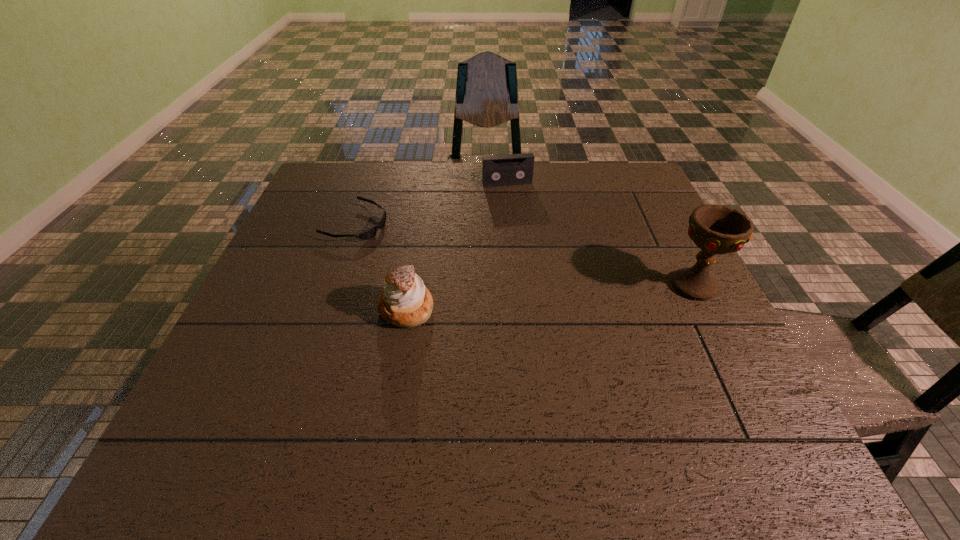
The image size is (960, 540). Identify the location of the second tallest object. (405, 302).

Identify the location of the second object from left to right. The height and width of the screenshot is (540, 960). (405, 302).

Identify the location of the rightmost object. Image resolution: width=960 pixels, height=540 pixels. (716, 229).

Where is `the tallest object`? Image resolution: width=960 pixels, height=540 pixels. the tallest object is located at coordinates [716, 229].

The width and height of the screenshot is (960, 540). Find the location of `the farthest object`. the farthest object is located at coordinates (497, 170).

The width and height of the screenshot is (960, 540). In order to click on the second shortest object in this screenshot , I will do `click(497, 170)`.

You are a GUI agent. You are given a task and a screenshot of the screen. Output one action in this format:
    pyautogui.click(x=<x>, y=<y>)
    Task: Click on the shortest object
    The height and width of the screenshot is (540, 960).
    Given the screenshot: What is the action you would take?
    pyautogui.click(x=371, y=232)

This screenshot has height=540, width=960. I want to click on sunglasses, so click(x=371, y=232).

Where is `vacant space located 0.290m on the left of the third object from right to left`? The height and width of the screenshot is (540, 960). vacant space located 0.290m on the left of the third object from right to left is located at coordinates (250, 308).

The image size is (960, 540). Identify the location of vacant area situated on the front of the chalice. (734, 367).